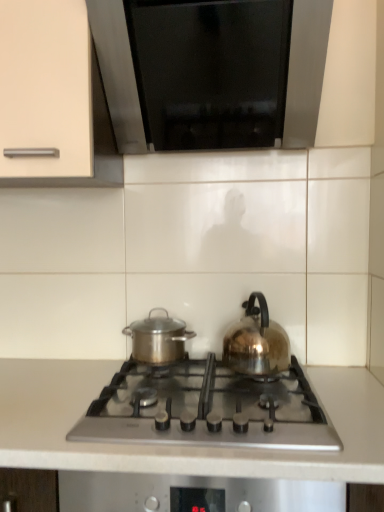
Locate an element on the screen. Image resolution: width=384 pixels, height=512 pixels. vacant point to the left of translucent glass kettle at right is located at coordinates (199, 371).